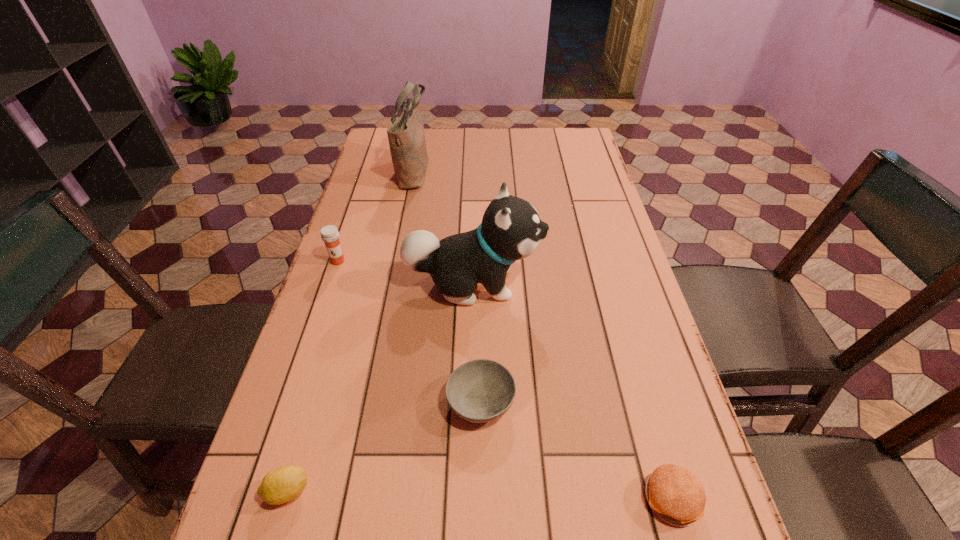
The width and height of the screenshot is (960, 540). What are the coordinates of `free space at the right edge of the desktop` in the screenshot? It's located at (616, 233).

This screenshot has width=960, height=540. In order to click on vacant space that is in between the bowl and the rightmost object in this screenshot , I will do tap(576, 450).

Where is `free space between the third nearest object and the puppy`? free space between the third nearest object and the puppy is located at coordinates (477, 342).

This screenshot has width=960, height=540. I want to click on vacant area that lies between the medicine and the third nearest object, so click(x=409, y=331).

In order to click on free space that is in between the rightmost object and the shoulder bag in this screenshot , I will do `click(542, 334)`.

Where is `unoccupied position between the hamburger and the bowl`? The height and width of the screenshot is (540, 960). unoccupied position between the hamburger and the bowl is located at coordinates (576, 450).

At what (x,y) coordinates should I click in order to perform the action: click on empty space between the fourth farthest object and the lemon. Please return your answer as a coordinate pair (x, y). This screenshot has width=960, height=540. Looking at the image, I should click on pos(384,446).

Identify the location of vacant space that's between the rightmost object and the puppy. (572, 391).

Locate an element on the screen. This screenshot has width=960, height=540. free space between the puppy and the bowl is located at coordinates (477, 342).

Locate which object is the fourth closest to the fourth farthest object. Please provide its 2D coordinates. Your answer should be formatted as a tuple, i.e. [(x, y)], where the tuple contains the x and y coordinates of a point satisfying the conditions above.

[(329, 234)]